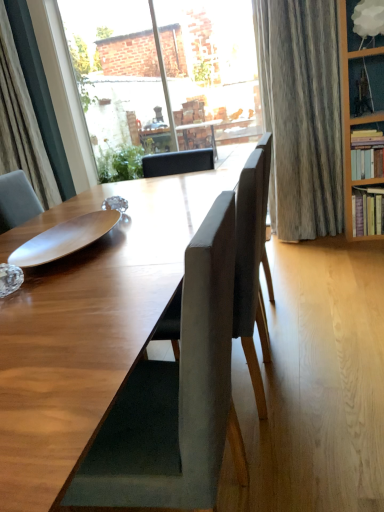
Question: Should I look upward or downward to see clear glass window at upper center?

Choices:
 (A) up
 (B) down

Answer: (A)

Question: Is white cloud lampshade at upper right, marked as the 3th shelf in a bottom-to-top arrangement, smaller than green leafy plant at center?

Choices:
 (A) yes
 (B) no

Answer: (A)

Question: Is white cloud lampshade at upper right, marked as the 3th shelf in a bottom-to-top arrangement, thinner than green leafy plant at center?

Choices:
 (A) yes
 (B) no

Answer: (A)

Question: Is white cloud lampshade at upper right, marked as the 3th shelf in a bottom-to-top arrangement, beside green leafy plant at center?

Choices:
 (A) yes
 (B) no

Answer: (B)

Question: From a real-world perspective, does white cloud lampshade at upper right, marked as the 3th shelf in a bottom-to-top arrangement, sit lower than green leafy plant at center?

Choices:
 (A) no
 (B) yes

Answer: (A)

Question: Is white cloud lampshade at upper right, which is the first shelf from top to bottom, oriented away from green leafy plant at center?

Choices:
 (A) yes
 (B) no

Answer: (B)

Question: Is green leafy plant at center a part of white cloud lampshade at upper right, marked as the 3th shelf in a bottom-to-top arrangement?

Choices:
 (A) no
 (B) yes

Answer: (A)

Question: Is clear glass window at upper center bigger than hardwood bookshelf at right, which appears as the second shelf when ordered from the bottom?

Choices:
 (A) no
 (B) yes

Answer: (B)

Question: Is clear glass window at upper center closer to the viewer compared to hardwood bookshelf at right, the 2th shelf when ordered from top to bottom?

Choices:
 (A) no
 (B) yes

Answer: (A)

Question: Is clear glass window at upper center not inside hardwood bookshelf at right, the 2th shelf when ordered from top to bottom?

Choices:
 (A) no
 (B) yes

Answer: (B)

Question: Is clear glass window at upper center facing towards hardwood bookshelf at right, the 2th shelf when ordered from top to bottom?

Choices:
 (A) no
 (B) yes

Answer: (A)

Question: Is clear glass window at upper center at the right side of hardwood bookshelf at right, which appears as the second shelf when ordered from the bottom?

Choices:
 (A) yes
 (B) no

Answer: (B)

Question: Could hardwood bookshelf at right, the 2th shelf when ordered from top to bottom, be considered to be inside clear glass window at upper center?

Choices:
 (A) no
 (B) yes

Answer: (A)

Question: Considering the relative sizes of white cloud lampshade at upper right, marked as the 3th shelf in a bottom-to-top arrangement, and hardcover books at right, which is the 3th shelf in top-to-bottom order, in the image provided, is white cloud lampshade at upper right, marked as the 3th shelf in a bottom-to-top arrangement, taller than hardcover books at right, which is the 3th shelf in top-to-bottom order,?

Choices:
 (A) no
 (B) yes

Answer: (A)